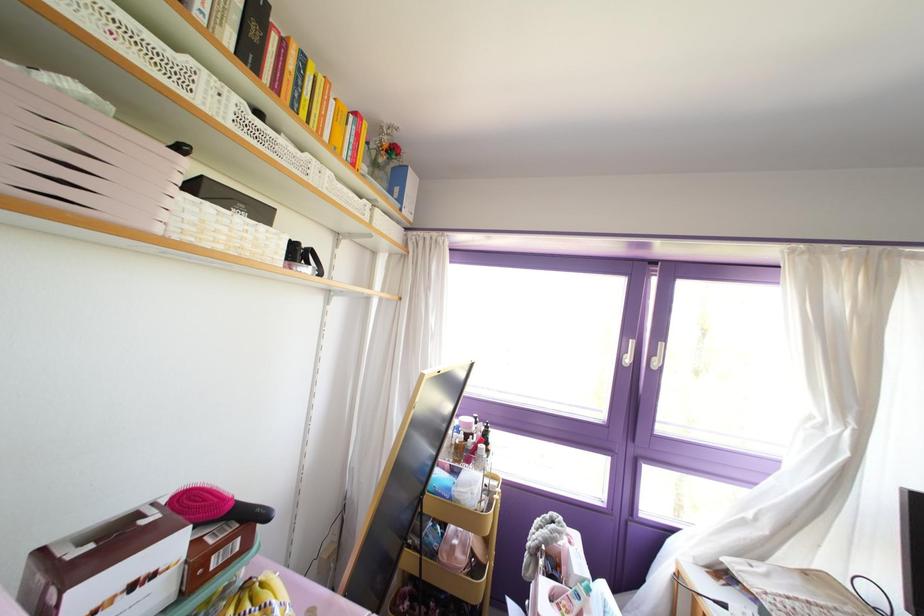
Which object does [110,565] point to?

This point indicates the black box.